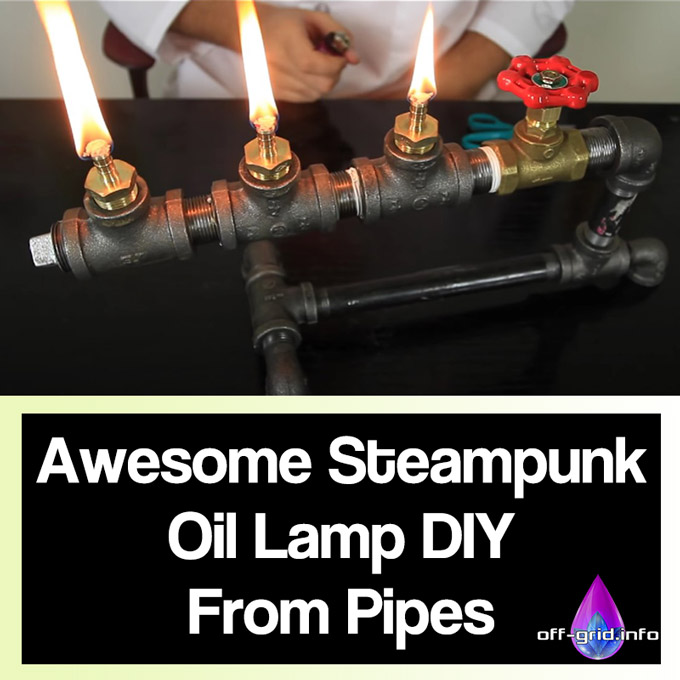
Where is `red knob`? red knob is located at coordinates (510, 86).